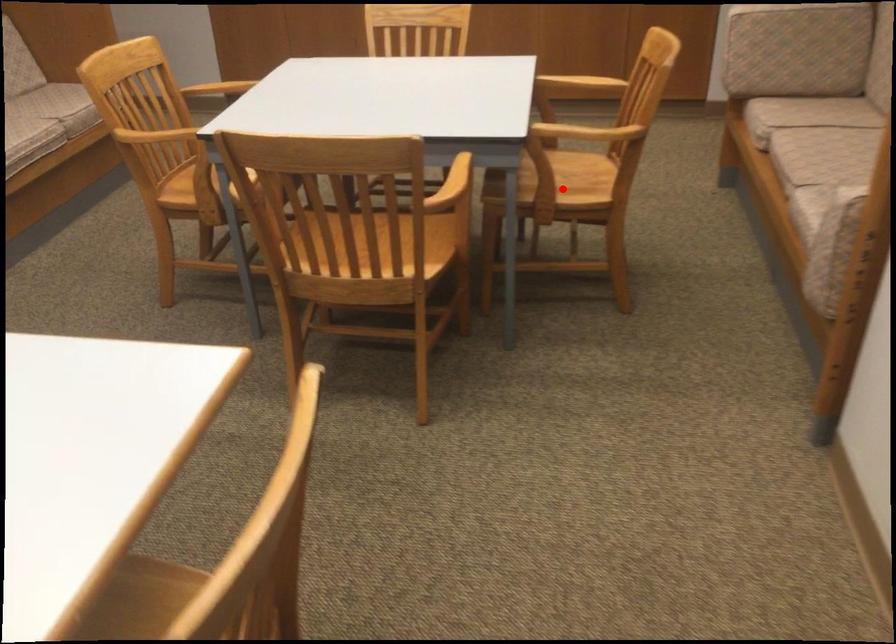
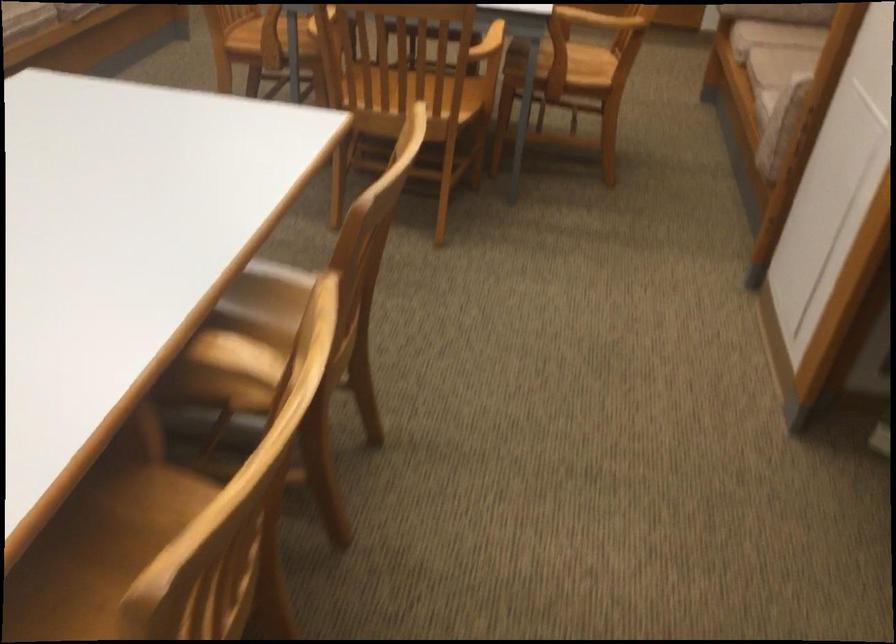
Find the pixel in the second image that matches the highlighted location in the first image.

(570, 69)